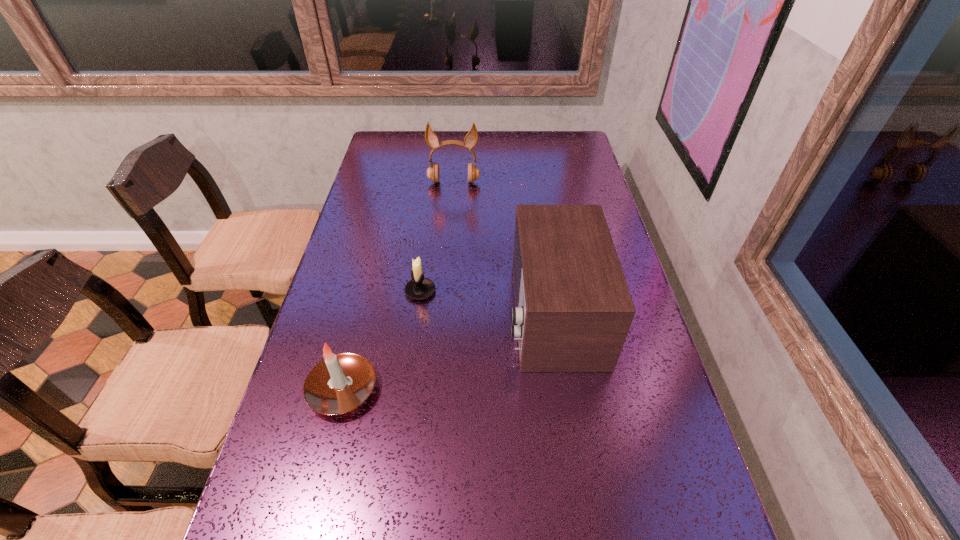
In order to click on the farthest object in this screenshot , I will do `click(471, 138)`.

Locate an element on the screen. the rightmost object is located at coordinates (573, 309).

Where is `the leftmost object`? The image size is (960, 540). the leftmost object is located at coordinates [339, 383].

The height and width of the screenshot is (540, 960). I want to click on candle, so click(339, 383).

I want to click on the shortest object, so click(x=419, y=288).

This screenshot has height=540, width=960. I want to click on vacant space located on the front-facing side of the earphone, so 448,249.

Where is `vacant space located 0.360m on the front-facing side of the rightmost object`? vacant space located 0.360m on the front-facing side of the rightmost object is located at coordinates (369, 313).

The image size is (960, 540). What are the coordinates of `vacant region located on the front-facing side of the rightmost object` in the screenshot? It's located at (369, 313).

Image resolution: width=960 pixels, height=540 pixels. What are the coordinates of `free space located on the front-facing side of the rightmost object` in the screenshot? It's located at (488, 313).

Locate an element on the screen. The image size is (960, 540). free space located on the right of the second shortest object is located at coordinates (426, 389).